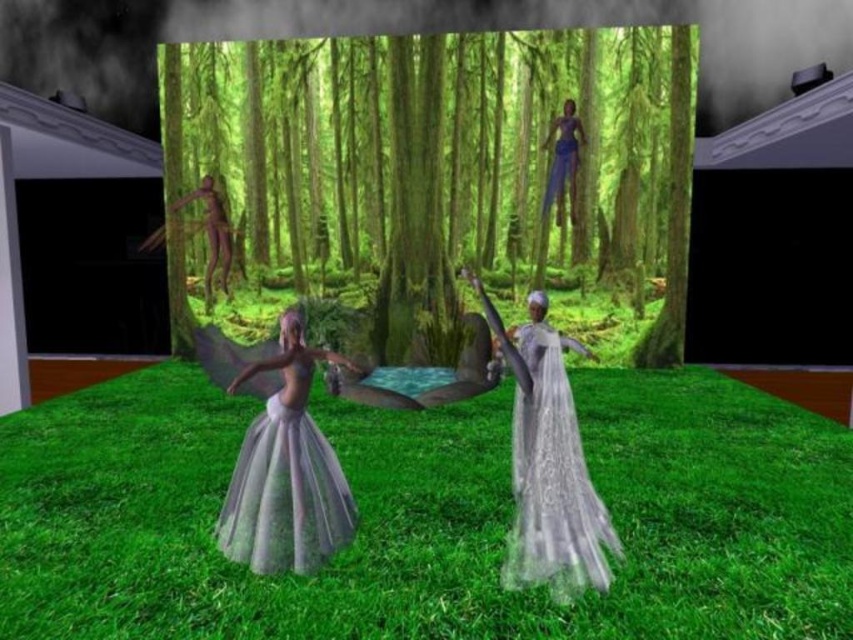
Question: Where is translucent silver dress at center located in relation to translucent white dress at center in the image?

Choices:
 (A) above
 (B) below

Answer: (A)

Question: Can you confirm if green matte tree at center is thinner than translucent silver dress at center?

Choices:
 (A) yes
 (B) no

Answer: (B)

Question: Which point is closer to the camera taking this photo?

Choices:
 (A) (595, 541)
 (B) (239, 474)
 (C) (325, 97)
 (D) (96, 576)

Answer: (A)

Question: Is the position of translucent silver dress at center less distant than that of translucent white dress at center?

Choices:
 (A) no
 (B) yes

Answer: (B)

Question: Which of the following is the farthest from the observer?

Choices:
 (A) translucent silver dress at center
 (B) green grass at center
 (C) green matte tree at center

Answer: (C)

Question: Which of these objects is positioned closest to the translucent white dress at center?

Choices:
 (A) translucent silver dress at center
 (B) green matte tree at center

Answer: (A)